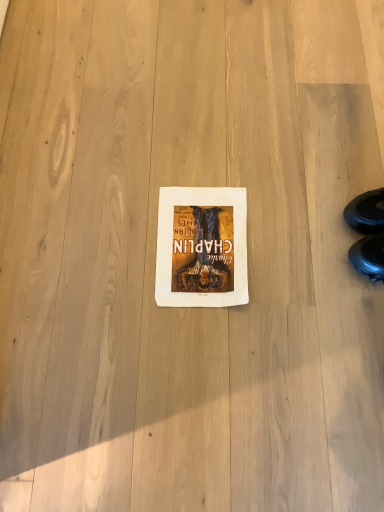
Question: Considering their positions, is black leather shoe at lower right located in front of or behind white paper at center?

Choices:
 (A) behind
 (B) front

Answer: (B)

Question: Is black leather shoe at lower right inside the boundaries of white paper at center, or outside?

Choices:
 (A) outside
 (B) inside

Answer: (A)

Question: Based on their sizes in the image, would you say black leather shoe at lower right is bigger or smaller than white paper at center?

Choices:
 (A) big
 (B) small

Answer: (A)

Question: Based on their positions, is white paper at center located to the left or right of black leather shoe at lower right?

Choices:
 (A) right
 (B) left

Answer: (B)

Question: Is white paper at center wider or thinner than black leather shoe at lower right?

Choices:
 (A) wide
 (B) thin

Answer: (A)

Question: Is white paper at center spatially inside black leather shoe at lower right, or outside of it?

Choices:
 (A) outside
 (B) inside

Answer: (A)

Question: In terms of size, does white paper at center appear bigger or smaller than black leather shoe at lower right?

Choices:
 (A) small
 (B) big

Answer: (A)